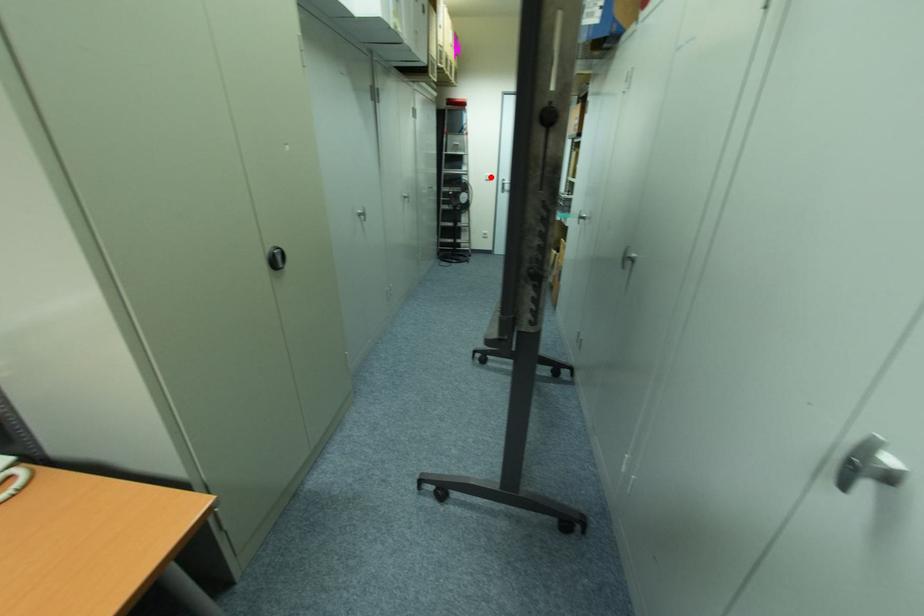
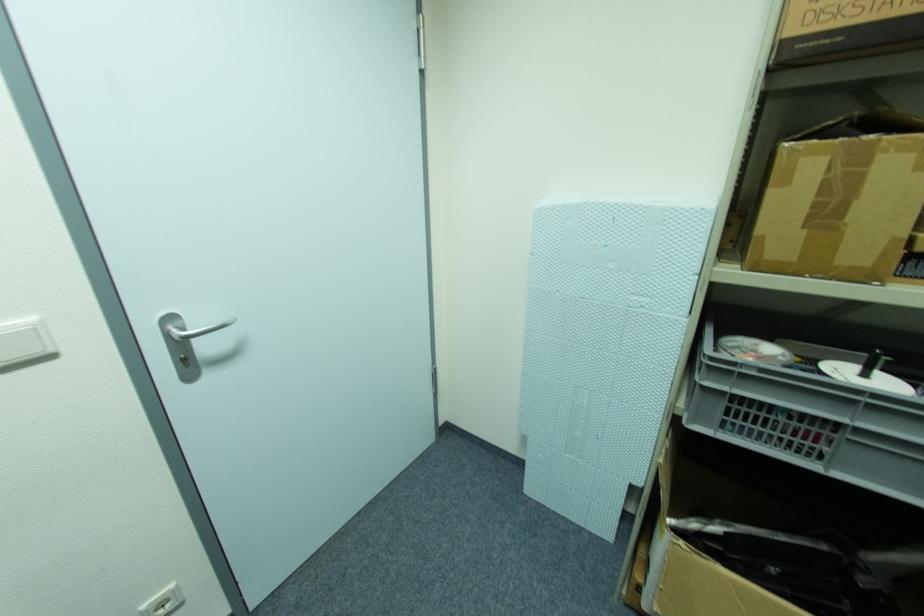
Question: I am providing you with two images of the same scene from different viewpoints. Given a red point in image1, look at the same physical point in image2. Is it:

Choices:
 (A) Closer to the viewpoint
 (B) Farther from the viewpoint

Answer: (B)